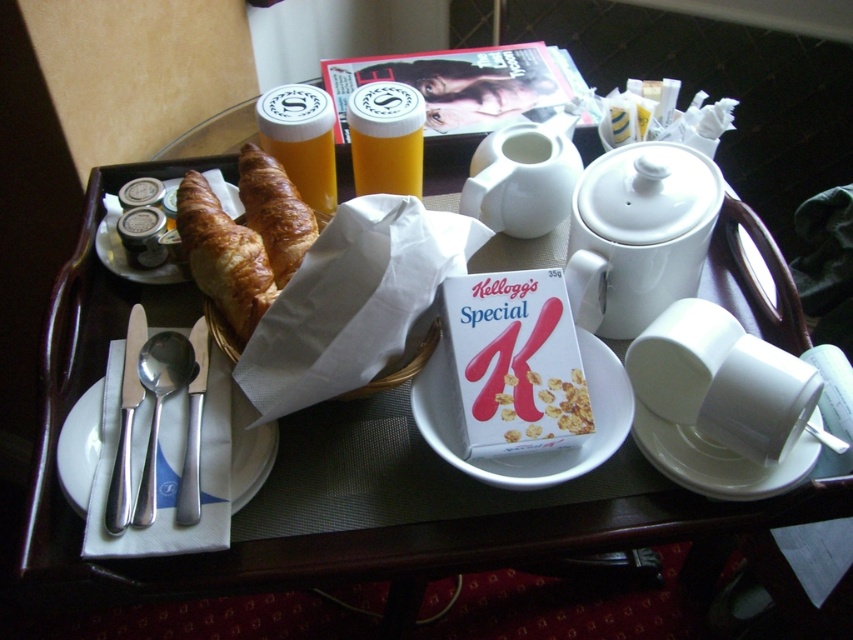
You are a hotel guest who wants to pour orange juice into the yellow plastic cup at center and the satin silver spoon at lower left. Which object should you use to drink the juice?

The yellow plastic cup at center should be used to drink the juice because the satin silver spoon at lower left is meant for eating and is larger than the cup.

You are a hotel guest who wants to pour orange juice from the translucent glass juice at center into the white porcelain plate at center. Will the juice fit into the plate without spilling?

The translucent glass juice at center is taller than the white porcelain plate at center, but this does not indicate the capacity of the plate. To determine if the juice will fit, you need to know the volume of both the glass and the plate. Since this information is not provided, it is uncertain whether the juice will spill.